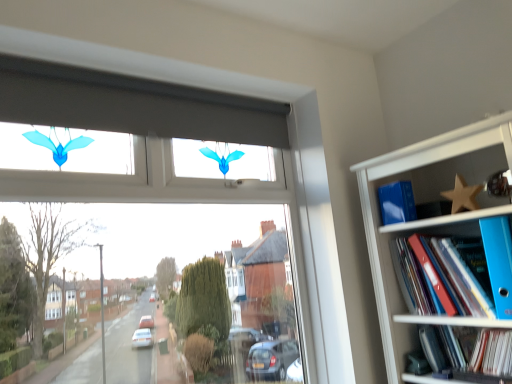
Question: From the image's perspective, is blue plastic folder at lower right, which is counted as the 2th book, starting from the top, positioned above or below blue plastic folder at right, placed as the first paperback book when sorted from right to left?

Choices:
 (A) below
 (B) above

Answer: (A)

Question: Is point (506, 374) positioned closer to the camera than point (506, 274)?

Choices:
 (A) closer
 (B) farther

Answer: (B)

Question: Estimate the real-world distances between objects in this image. Which object is closer to the blue plastic folder at lower right, which is counted as the 2th book, starting from the top?

Choices:
 (A) blue plastic folders at upper right
 (B) wooden star at upper right
 (C) blue plastic folder at right, acting as the 1th book starting from the top
 (D) blue plastic folder at right, the second paperback book viewed from the left
 (E) blue matte book at upper right, placed as the 1th paperback book when sorted from back to front

Answer: (D)

Question: Which of these objects is positioned closest to the blue matte book at upper right, placed as the 1th paperback book when sorted from back to front?

Choices:
 (A) blue plastic folder at right, the 2th book in the bottom-to-top sequence
 (B) blue plastic folders at upper right
 (C) blue plastic folder at lower right, which is counted as the 2th book, starting from the top
 (D) blue plastic folder at right, positioned as the 1th paperback book in front-to-back order
 (E) wooden star at upper right

Answer: (E)